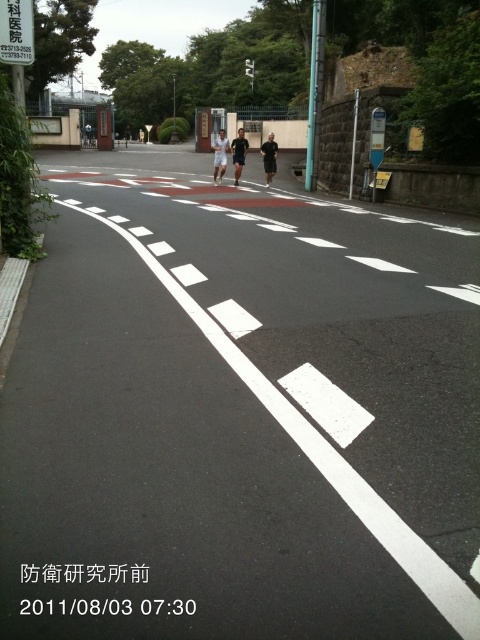
Does white plastic sign at upper left appear on the right side of black matte shirt at center?

Incorrect, white plastic sign at upper left is not on the right side of black matte shirt at center.

Does point (12, 45) come behind point (263, 148)?

No, (12, 45) is in front of (263, 148).

Between point (2, 0) and point (264, 156), which one is positioned behind?

The point (264, 156) is more distant.

The width and height of the screenshot is (480, 640). I want to click on white plastic sign at upper left, so click(x=16, y=32).

Between point (223, 161) and point (264, 170), which one is positioned in front?

Point (223, 161) is more forward.

Is white matte shirt at center positioned before black matte shirt at center?

Yes, white matte shirt at center is closer to the viewer.

Is point (216, 173) closer to viewer compared to point (274, 154)?

That is False.

Locate an element on the screen. The height and width of the screenshot is (640, 480). white matte shirt at center is located at coordinates (219, 156).

Which is above, white plastic sign at upper left or dark blue fabric shirt at center?

dark blue fabric shirt at center is higher up.

Does white plastic sign at upper left have a greater height compared to dark blue fabric shirt at center?

No.

Is point (27, 8) closer to viewer compared to point (233, 161)?

That is True.

Locate an element on the screen. white plastic sign at upper left is located at coordinates (16, 32).